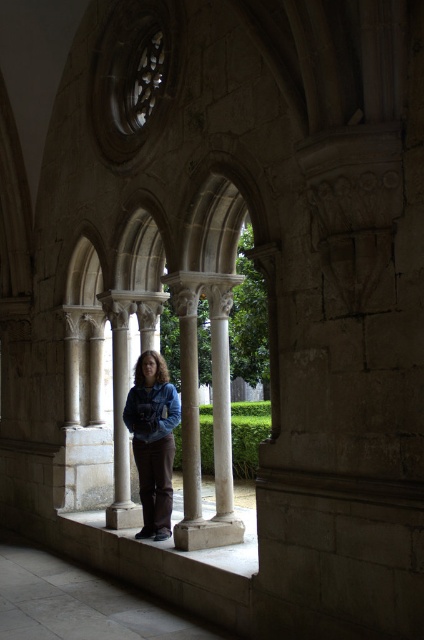
Does point (159, 474) come in front of point (130, 388)?

Yes, it is in front of point (130, 388).

Is blue denim jacket at center shorter than denim jacket at center?

In fact, blue denim jacket at center may be taller than denim jacket at center.

Does point (153, 369) lie in front of point (150, 417)?

No, it is behind (150, 417).

The height and width of the screenshot is (640, 424). Identify the location of blue denim jacket at center. (153, 440).

Can you confirm if white stone column at center is taller than denim jacket at center?

Correct, white stone column at center is much taller as denim jacket at center.

Can you confirm if white stone column at center is positioned to the right of denim jacket at center?

Correct, you'll find white stone column at center to the right of denim jacket at center.

Describe the element at coordinates (198, 410) in the screenshot. I see `white stone column at center` at that location.

Where is `white stone column at center`? This screenshot has width=424, height=640. white stone column at center is located at coordinates (198, 410).

At what (x,y) coordinates should I click in order to perform the action: click on blue denim jacket at center. Please return your answer as a coordinate pair (x, y). Image resolution: width=424 pixels, height=640 pixels. Looking at the image, I should click on (153, 440).

Who is shorter, blue denim jacket at center or white stone ledge at center?

Standing shorter between the two is white stone ledge at center.

At what (x,y) coordinates should I click in order to perform the action: click on blue denim jacket at center. Please return your answer as a coordinate pair (x, y). The height and width of the screenshot is (640, 424). Looking at the image, I should click on (153, 440).

Where is `blue denim jacket at center`? The width and height of the screenshot is (424, 640). blue denim jacket at center is located at coordinates (153, 440).